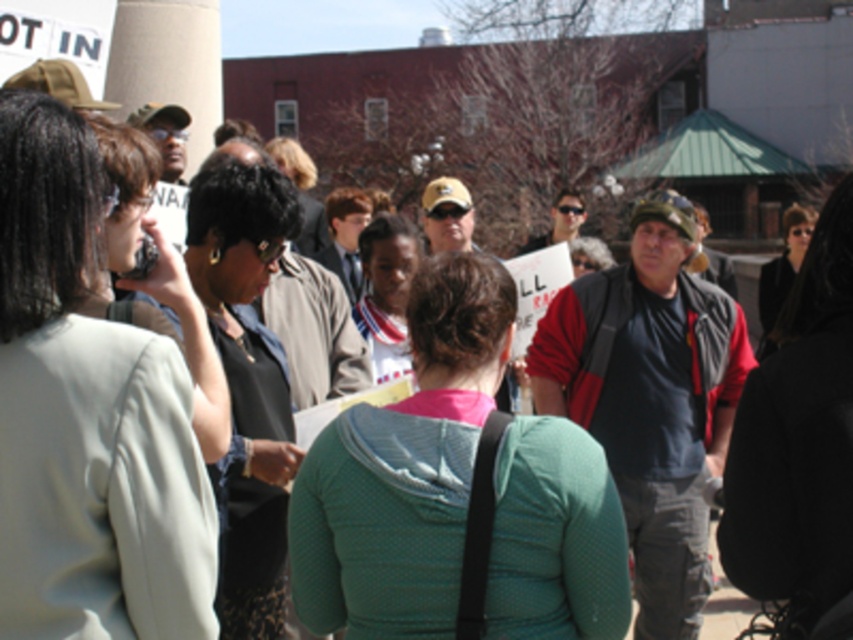
Is light beige jacket at left to the right of green textured sweater at center from the viewer's perspective?

Incorrect, light beige jacket at left is not on the right side of green textured sweater at center.

Between light beige jacket at left and green textured sweater at center, which one appears on the right side from the viewer's perspective?

green textured sweater at center

Is point (19, 404) positioned behind point (434, 403)?

No, it is not.

Locate an element on the screen. The image size is (853, 640). light beige jacket at left is located at coordinates (86, 416).

Measure the distance from light beige jacket at left to black fabric jacket at center.

light beige jacket at left is 2.22 meters from black fabric jacket at center.

Locate an element on the screen. light beige jacket at left is located at coordinates (86, 416).

Between point (404, 449) and point (283, 474), which one is positioned behind?

Positioned behind is point (283, 474).

Which is above, green textured sweater at center or matte black shirt at center?

matte black shirt at center

Measure the distance between point (349, 547) and camera.

Point (349, 547) and camera are 4.44 meters apart.

What are the coordinates of `green textured sweater at center` in the screenshot? It's located at (404, 468).